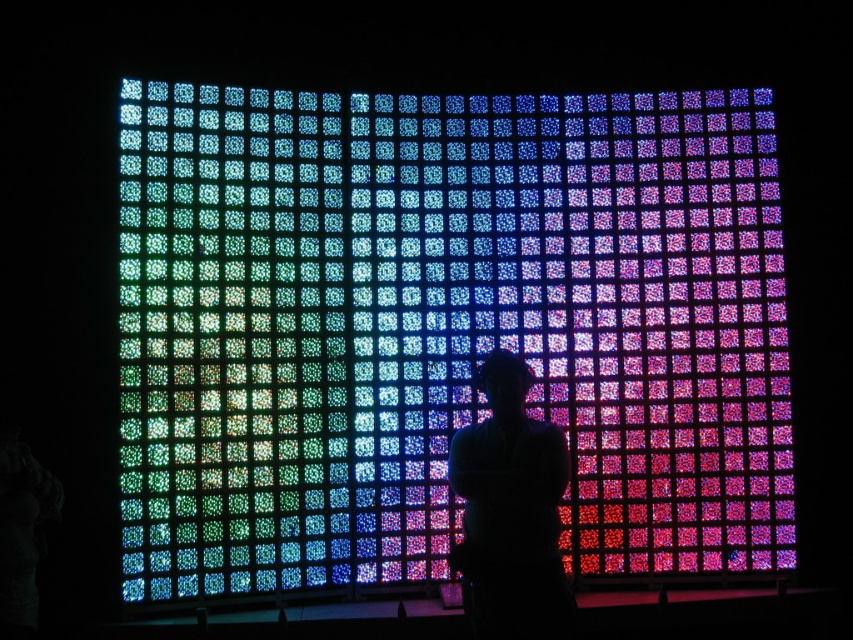
You are an artist trying to capture the scene in front of you. You notice the multicolored glass mosaic at center and the silhouette figure at center. Which object should you focus on first if you want to emphasize the larger subject in your artwork?

The multicolored glass mosaic at center has a larger size compared to the silhouette figure at center, so you should focus on the multicolored glass mosaic at center first to emphasize the larger subject in your artwork.

You are an artist standing in front of the multicolored glass mosaic at center and the silhouette figure at center. You want to paint the scene as it appears. Which object should you paint first if you want to follow the standard left to right painting technique?

The multicolored glass mosaic at center should be painted first because it is positioned on the left side of the silhouette figure at center, so following left to right technique, you start with the multicolored glass mosaic at center.

In the scene shown: You are a photographer trying to capture the silhouette figure at center against the multicolored glass mosaic at center. Since the mosaic is wider than the figure, how should you position your camera to ensure the entire silhouette is framed without cutting off any part?

Position the camera so that the silhouette figure at center is centered within the multicolored glass mosaic at center. Since the mosaic is wider, there will be enough space on both sides of the silhouette figure at center to keep it fully framed.